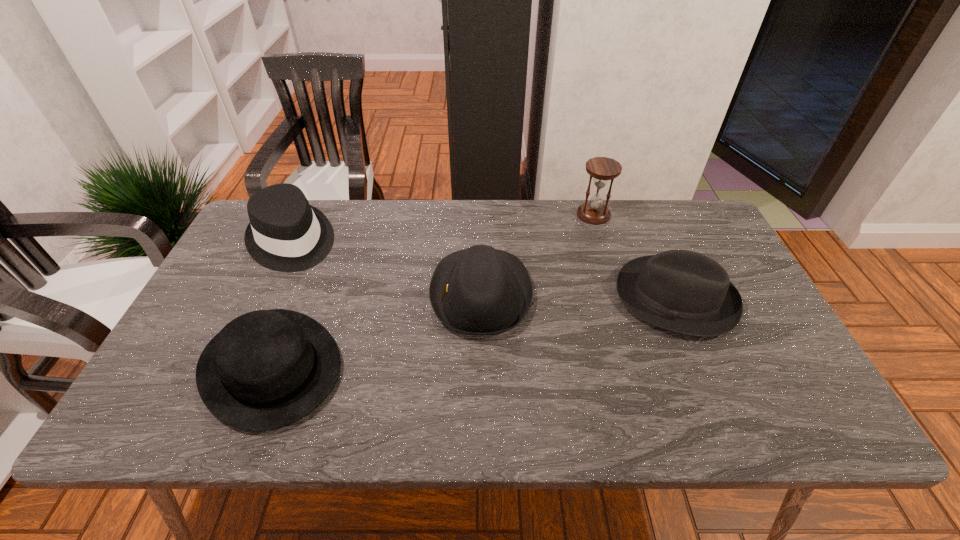
Select which fedora appears as the closest to the third fedora from left to right. Please provide its 2D coordinates. Your answer should be formatted as a tuple, i.e. [(x, y)], where the tuple contains the x and y coordinates of a point satisfying the conditions above.

[(266, 369)]

Find the location of `vacant area that satisfies the following two spatial constraints: 1. on the front-facing side of the third object from left to right; 2. on the back side of the rightmost fedora`. vacant area that satisfies the following two spatial constraints: 1. on the front-facing side of the third object from left to right; 2. on the back side of the rightmost fedora is located at coordinates (481, 298).

Where is `vacant space that satisfies the following two spatial constraints: 1. on the front-facing side of the rightmost fedora; 2. on the right side of the third fedora from left to right`? This screenshot has width=960, height=540. vacant space that satisfies the following two spatial constraints: 1. on the front-facing side of the rightmost fedora; 2. on the right side of the third fedora from left to right is located at coordinates (481, 298).

Locate an element on the screen. free location that satisfies the following two spatial constraints: 1. on the front side of the hourglass; 2. on the front-facing side of the third object from left to right is located at coordinates (617, 294).

The width and height of the screenshot is (960, 540). I want to click on free space that satisfies the following two spatial constraints: 1. on the front side of the tallest object; 2. on the front-facing side of the second fedora from right to left, so click(617, 294).

Where is `vacant space that satisfies the following two spatial constraints: 1. on the front-facing side of the rightmost fedora; 2. on the right side of the third object from left to right`? This screenshot has width=960, height=540. vacant space that satisfies the following two spatial constraints: 1. on the front-facing side of the rightmost fedora; 2. on the right side of the third object from left to right is located at coordinates (481, 298).